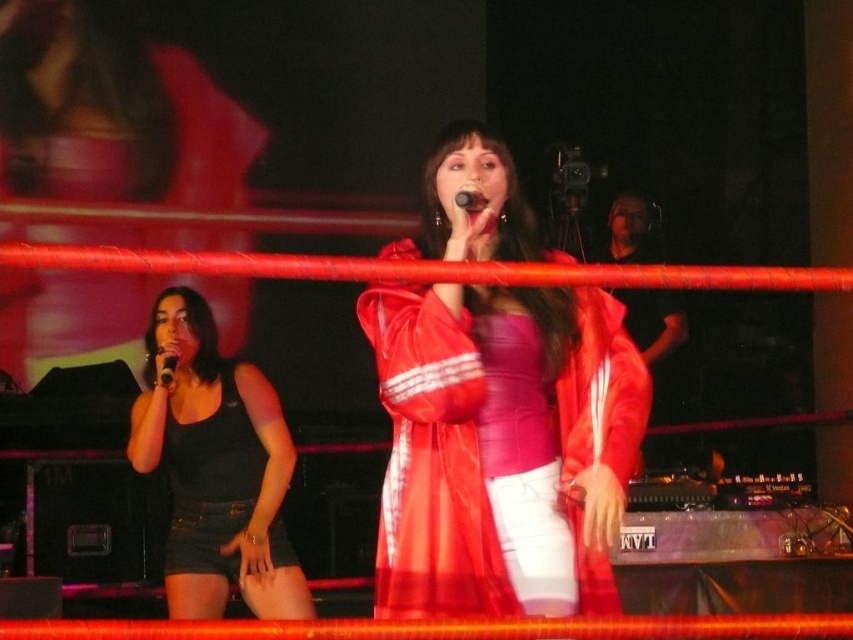
Question: Where is black matte tank top at left located in relation to black matte microphone at left in the image?

Choices:
 (A) above
 (B) below

Answer: (B)

Question: Does black fabric tank top at left appear under black matte tank top at left?

Choices:
 (A) yes
 (B) no

Answer: (B)

Question: Can you confirm if matte red jacket at center is thinner than black plastic microphone at center?

Choices:
 (A) no
 (B) yes

Answer: (A)

Question: Among these objects, which one is nearest to the camera?

Choices:
 (A) black fabric tank top at left
 (B) black plastic microphone at center
 (C) black matte microphone at left

Answer: (B)

Question: Which point is farther from the camera taking this photo?

Choices:
 (A) (171, 358)
 (B) (207, 525)
 (C) (569, 385)
 (D) (466, 193)

Answer: (B)

Question: Which point is farther to the camera?

Choices:
 (A) pyautogui.click(x=233, y=397)
 (B) pyautogui.click(x=473, y=205)
 (C) pyautogui.click(x=398, y=616)
 (D) pyautogui.click(x=170, y=360)

Answer: (A)